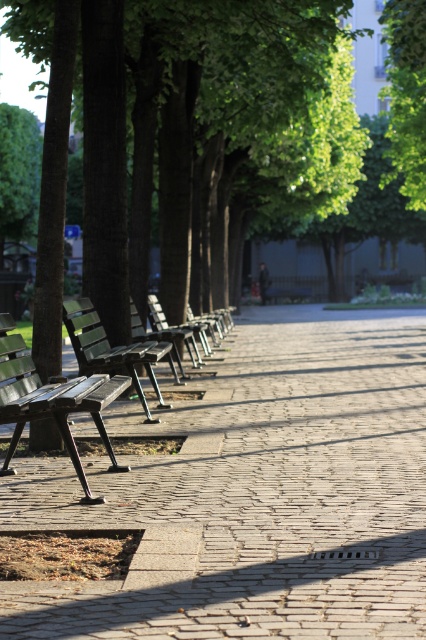
You are a maintenance worker needing to reach the brick paved walkway at center from your current position. Can you walk directly to it without any obstacles in your path?

The brick paved walkway at center is 4.57 meters away from you, so yes, you can walk directly to it without any obstacles in your path.

You are standing at the entrance of the park and want to reach both the point at coordinates point (348, 618) and point (114, 365). Which point should you head towards first if you want to visit the closer one first?

Point (348, 618) is closer to the viewer than point (114, 365), so you should head towards point (348, 618) first.

You are standing at the viewpoint of the image and want to place a small decorative stone between the two points, point (39, 388) and point (135, 385). Which point should the stone be closer to in order to be nearer to the viewer?

The stone should be placed closer to point (39, 388) because it is closer to the viewer than point (135, 385).